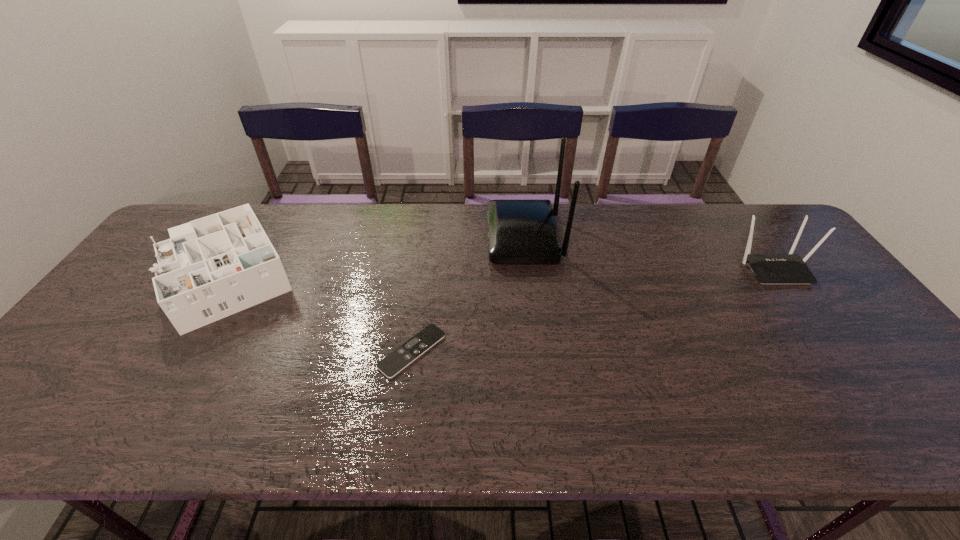
Find the location of `free space located on the front-facing side of the tallest object`. free space located on the front-facing side of the tallest object is located at coordinates (438, 238).

The height and width of the screenshot is (540, 960). In order to click on vacant space situated 0.250m on the front-facing side of the shorter router in this screenshot , I will do `click(840, 359)`.

The width and height of the screenshot is (960, 540). What are the coordinates of `free space located 0.130m on the right of the leftmost object` in the screenshot? It's located at (346, 270).

The image size is (960, 540). Find the location of `vacant space located on the left of the second object from left to right`. vacant space located on the left of the second object from left to right is located at coordinates (344, 351).

Where is `router present at the far edge`? Image resolution: width=960 pixels, height=540 pixels. router present at the far edge is located at coordinates (519, 231).

You are a GUI agent. You are given a task and a screenshot of the screen. Output one action in this format:
    pyautogui.click(x=<x>, y=<y>)
    Task: Click on the dollhouse that is at the far edge
    The height and width of the screenshot is (540, 960).
    Given the screenshot: What is the action you would take?
    pyautogui.click(x=212, y=267)

At what (x,y) coordinates should I click in order to perform the action: click on object at the left edge. Please return your answer as a coordinate pair (x, y). The image size is (960, 540). Looking at the image, I should click on (212, 267).

I want to click on object at the right edge, so click(789, 268).

The height and width of the screenshot is (540, 960). What are the coordinates of `object that is at the far left corner` in the screenshot? It's located at tap(212, 267).

Locate an element on the screen. This screenshot has width=960, height=540. free space at the far edge is located at coordinates (588, 235).